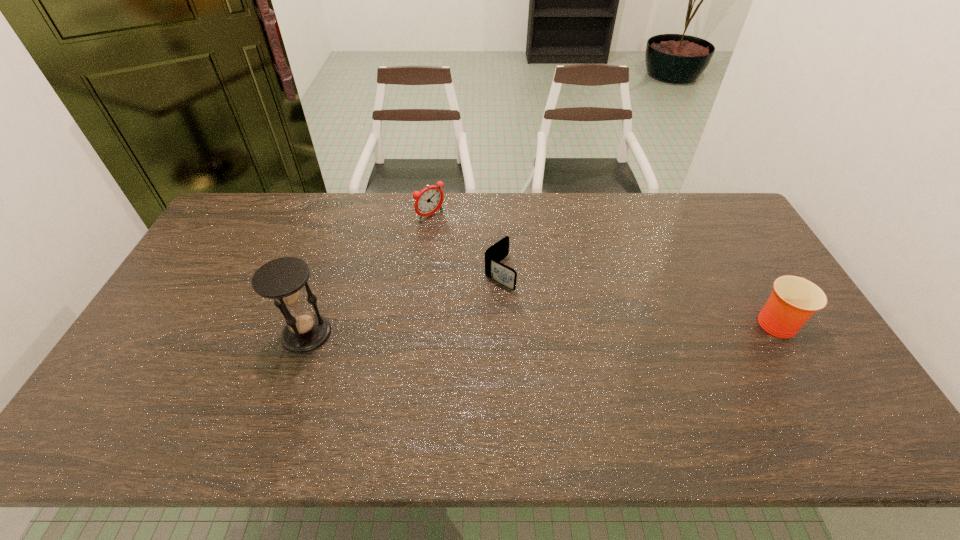
Image resolution: width=960 pixels, height=540 pixels. Identify the location of free spot between the hourglass and the rightmost object. (x=541, y=327).

Identify the location of vacant region between the third nearest object and the leftmost object. (403, 303).

The width and height of the screenshot is (960, 540). In order to click on vacant point located between the hourglass and the third nearest object in this screenshot , I will do `click(403, 303)`.

Select which object is the closest to the cup. Please provide its 2D coordinates. Your answer should be formatted as a tuple, i.e. [(x, y)], where the tuple contains the x and y coordinates of a point satisfying the conditions above.

[(504, 275)]

The width and height of the screenshot is (960, 540). What are the coordinates of `object that ranks as the third closest to the wallet` in the screenshot? It's located at (794, 300).

You are a GUI agent. You are given a task and a screenshot of the screen. Output one action in this format:
    pyautogui.click(x=<x>, y=<y>)
    Task: Click on the vacant space that satisfies the following two spatial constraints: 1. on the back side of the third nearest object; 2. on the left side of the tallest object
    This screenshot has height=540, width=960.
    Given the screenshot: What is the action you would take?
    pyautogui.click(x=327, y=273)